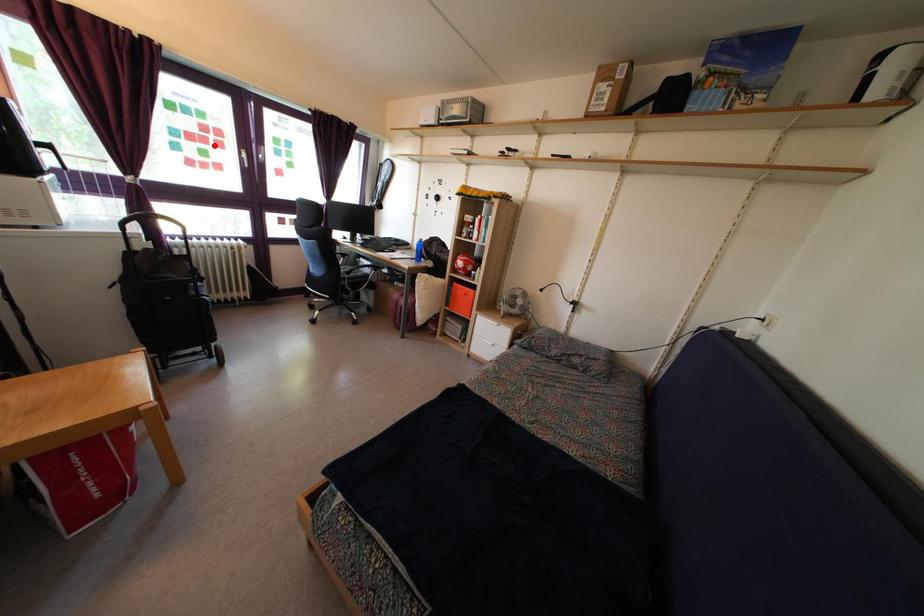
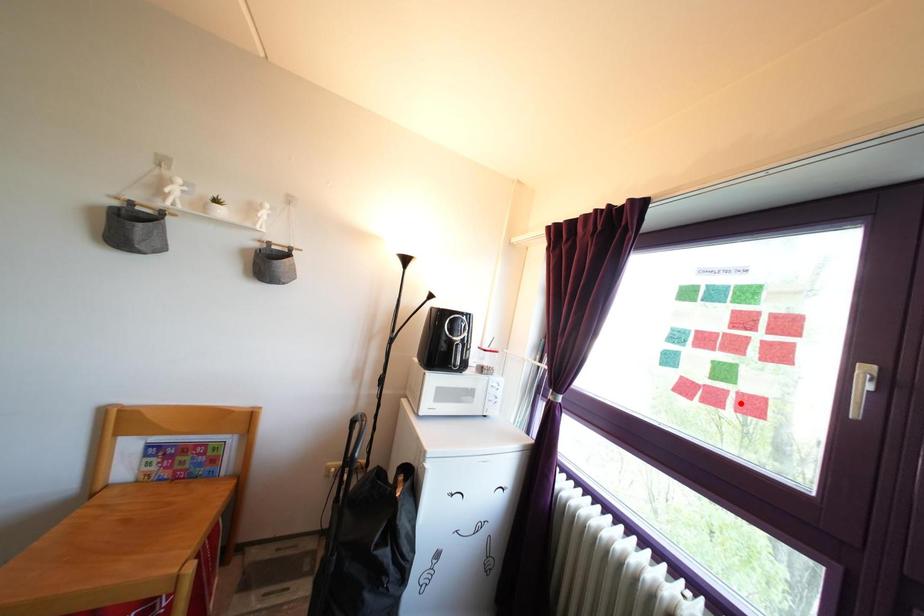
I am providing you with two images of the same scene from different viewpoints. A red point is marked on the first image and another point is marked on the second image. Is the marked point in image1 the same physical position as the marked point in image2?

No